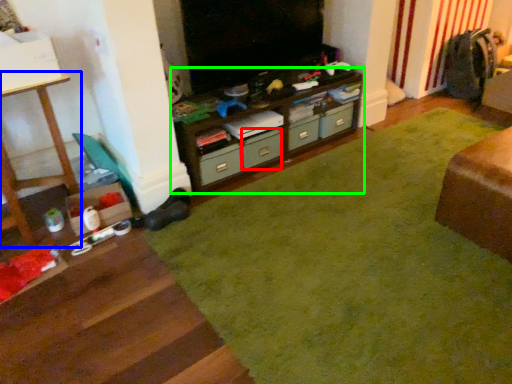
Question: Which object is positioned closest to drawer (highlighted by a red box)? Select from furniture (highlighted by a blue box) and cabinetry (highlighted by a green box).

Choices:
 (A) furniture
 (B) cabinetry

Answer: (B)